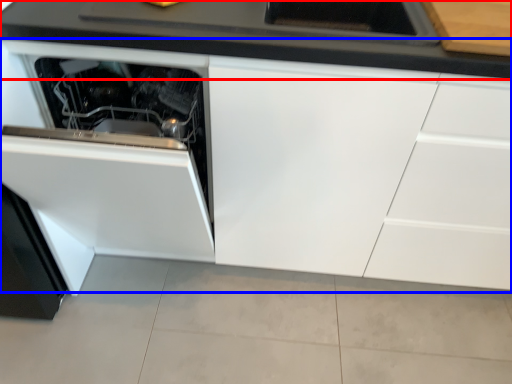
Question: Which object is closer to the camera taking this photo, countertop (highlighted by a red box) or cabinetry (highlighted by a blue box)?

Choices:
 (A) countertop
 (B) cabinetry

Answer: (B)